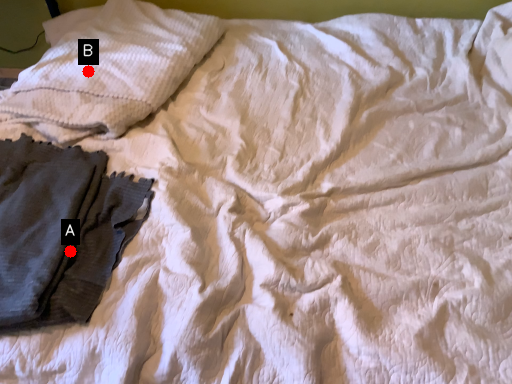
Question: Two points are circled on the image, labeled by A and B beside each circle. Which of the following is the farthest from the observer?

Choices:
 (A) A is further
 (B) B is further

Answer: (B)